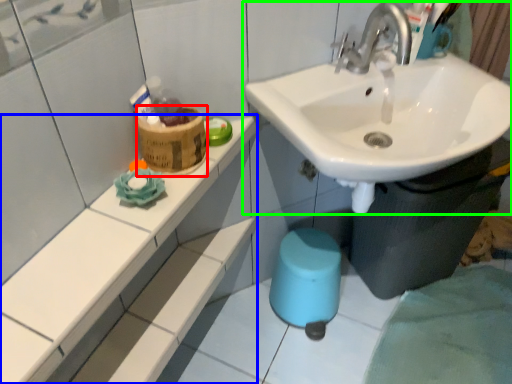
Question: Based on their relative distances, which object is nearer to potty (highlighted by a red box)? Choose from counter top (highlighted by a blue box) and sink (highlighted by a green box).

Choices:
 (A) counter top
 (B) sink

Answer: (A)